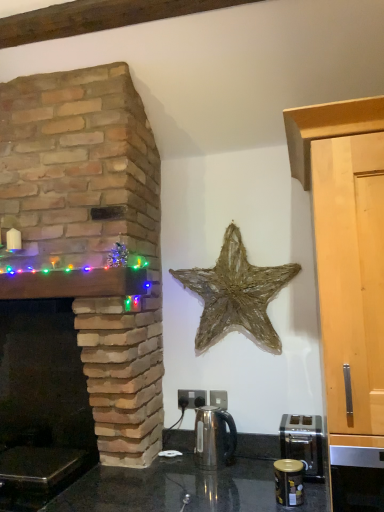
Question: Is natural stone fireplace at left not within satin silver kettle at center?

Choices:
 (A) yes
 (B) no

Answer: (A)

Question: Does natural stone fireplace at left appear on the left side of satin silver kettle at center?

Choices:
 (A) yes
 (B) no

Answer: (A)

Question: Is natural stone fireplace at left not close to satin silver kettle at center?

Choices:
 (A) yes
 (B) no

Answer: (B)

Question: Can you confirm if natural stone fireplace at left is thinner than satin silver kettle at center?

Choices:
 (A) yes
 (B) no

Answer: (B)

Question: From the image's perspective, is natural stone fireplace at left on satin silver kettle at center?

Choices:
 (A) yes
 (B) no

Answer: (A)

Question: Is woven straw star at center in front of or behind satin silver toaster at lower right, the 2th appliance in the front-to-back sequence, in the image?

Choices:
 (A) front
 (B) behind

Answer: (B)

Question: Is woven straw star at center taller or shorter than satin silver toaster at lower right, the 2th appliance in the front-to-back sequence?

Choices:
 (A) short
 (B) tall

Answer: (B)

Question: Is woven straw star at center to the left or to the right of satin silver toaster at lower right, the first appliance from the back, in the image?

Choices:
 (A) left
 (B) right

Answer: (A)

Question: From a real-world perspective, is woven straw star at center physically located above or below satin silver toaster at lower right, the 2th appliance in the front-to-back sequence?

Choices:
 (A) above
 (B) below

Answer: (A)

Question: From the image's perspective, is light wood cabinet at right above or below satin silver kettle at center?

Choices:
 (A) above
 (B) below

Answer: (A)

Question: Is light wood cabinet at right inside the boundaries of satin silver kettle at center, or outside?

Choices:
 (A) outside
 (B) inside

Answer: (A)

Question: Is point (324, 286) closer or farther from the camera than point (216, 441)?

Choices:
 (A) farther
 (B) closer

Answer: (B)

Question: Considering the positions of light wood cabinet at right and satin silver kettle at center in the image, is light wood cabinet at right taller or shorter than satin silver kettle at center?

Choices:
 (A) tall
 (B) short

Answer: (A)

Question: Is satin silver kettle at center to the left or to the right of light wood cabinet at right in the image?

Choices:
 (A) left
 (B) right

Answer: (A)

Question: Looking at their shapes, would you say satin silver kettle at center is wider or thinner than light wood cabinet at right?

Choices:
 (A) wide
 (B) thin

Answer: (B)